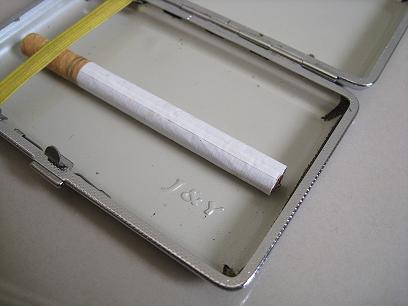
Locate an element on the screen. tray is located at coordinates (183, 80), (334, 42).